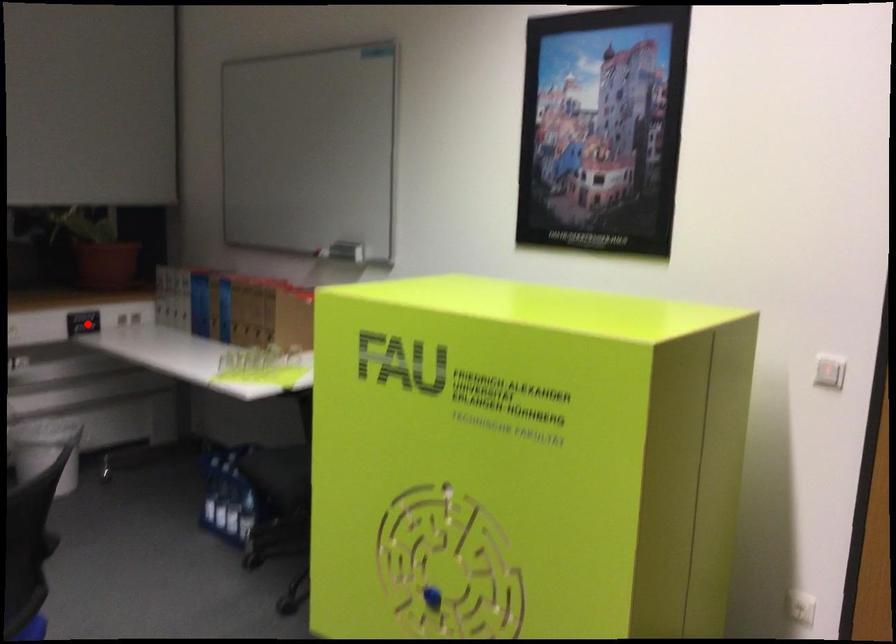
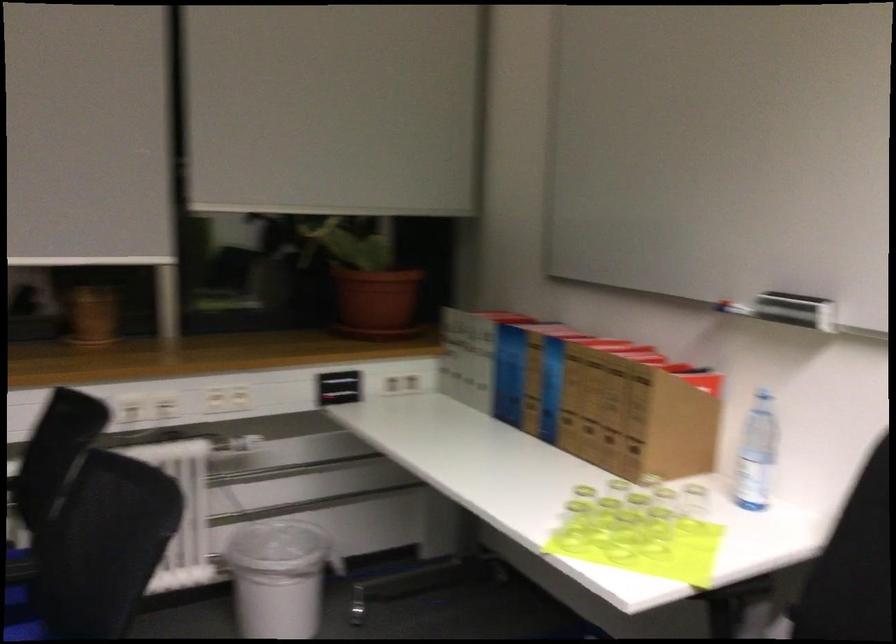
The point at the highlighted location is marked in the first image. Where is the corresponding point in the second image?

(339, 386)